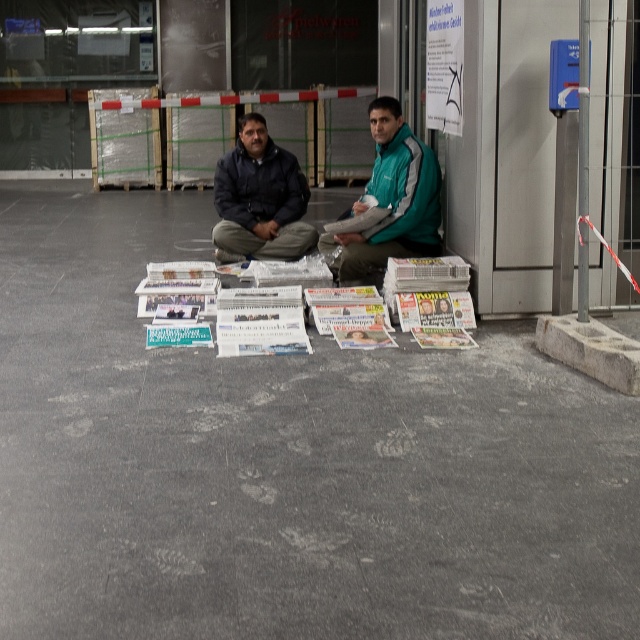
Question: Which object appears farthest from the camera in this image?

Choices:
 (A) gray concrete floor at center
 (B) teal fabric jacket at center

Answer: (B)

Question: Which object is farther from the camera taking this photo?

Choices:
 (A) teal fabric jacket at center
 (B) dark blue jacket at center
 (C) white glossy magazines at center
 (D) gray concrete floor at center

Answer: (B)

Question: Considering the relative positions of gray concrete floor at center and white glossy magazines at center in the image provided, where is gray concrete floor at center located with respect to white glossy magazines at center?

Choices:
 (A) below
 (B) above

Answer: (A)

Question: Considering the relative positions of teal fabric jacket at center and dark blue jacket at center in the image provided, where is teal fabric jacket at center located with respect to dark blue jacket at center?

Choices:
 (A) left
 (B) right

Answer: (B)

Question: Which object is farther from the camera taking this photo?

Choices:
 (A) gray concrete floor at center
 (B) dark blue jacket at center
 (C) white glossy magazines at center
 (D) teal fabric jacket at center

Answer: (B)

Question: Can you confirm if teal fabric jacket at center is positioned below dark blue jacket at center?

Choices:
 (A) yes
 (B) no

Answer: (A)